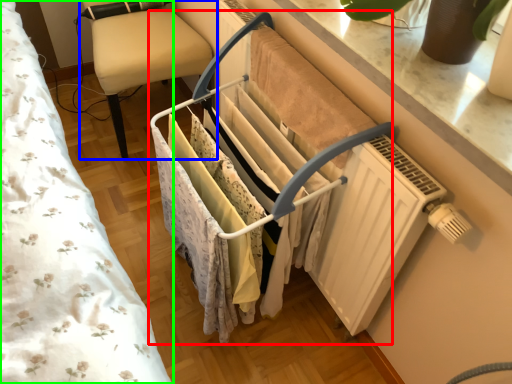
Question: Estimate the real-world distances between objects in this image. Which object is farther from closet (highlighted by a red box), furniture (highlighted by a blue box) or bed (highlighted by a green box)?

Choices:
 (A) furniture
 (B) bed

Answer: (A)